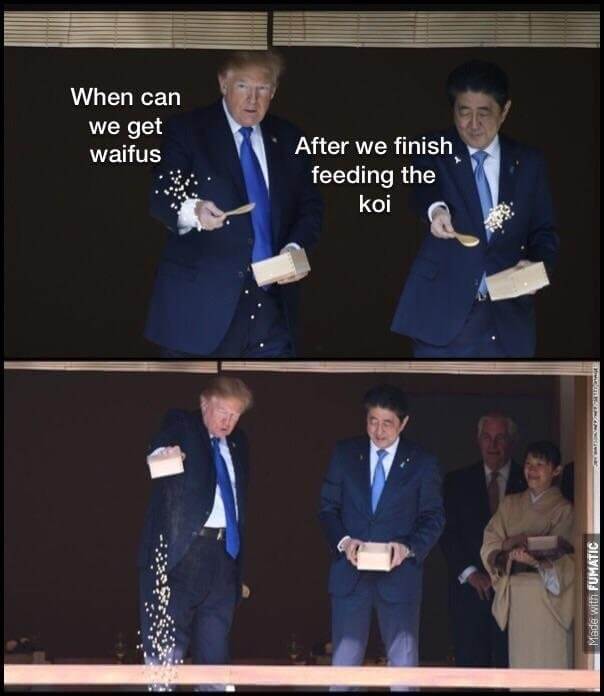
I want to click on boxes in lower picture, so click(174, 464), click(378, 550).